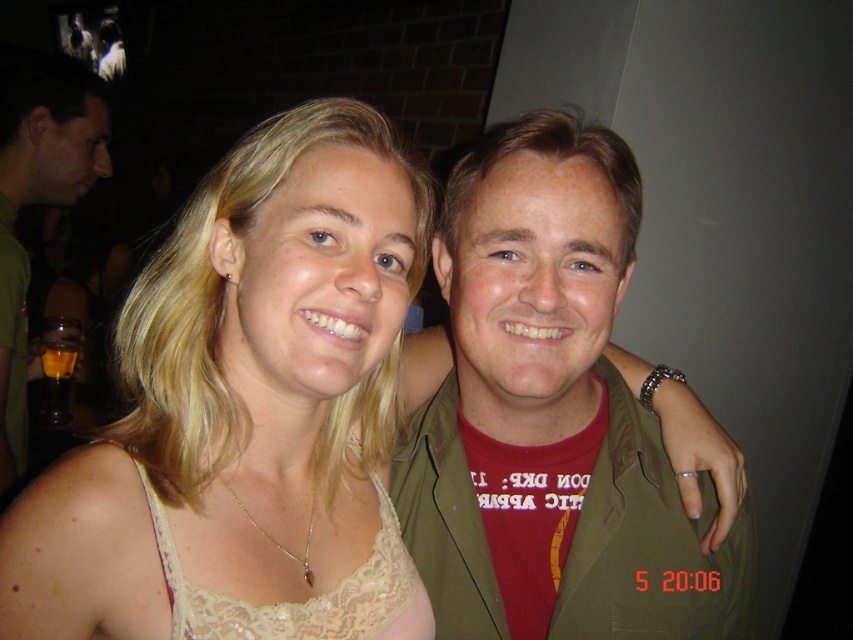
You are a photographer adjusting the camera settings for a portrait of two people. The camera has a depth of field that can focus clearly on objects within a 5 inch range. Given the lace beige top at center and green matte jacket at center are 6.36 inches apart, will both items be in focus simultaneously?

The lace beige top at center and green matte jacket at center are 6.36 inches apart. Since the depth of field can only focus within a 5 inch range, the two items are beyond this range, so they cannot both be in focus at the same time.

You are trying to decide which green item to take with you from the scene. The green matte jacket at center and the green matte shirt at left are both visible. Based on their positions, which one is located lower in the image?

The green matte jacket at center is positioned under the green matte shirt at left, so it is located lower in the image.